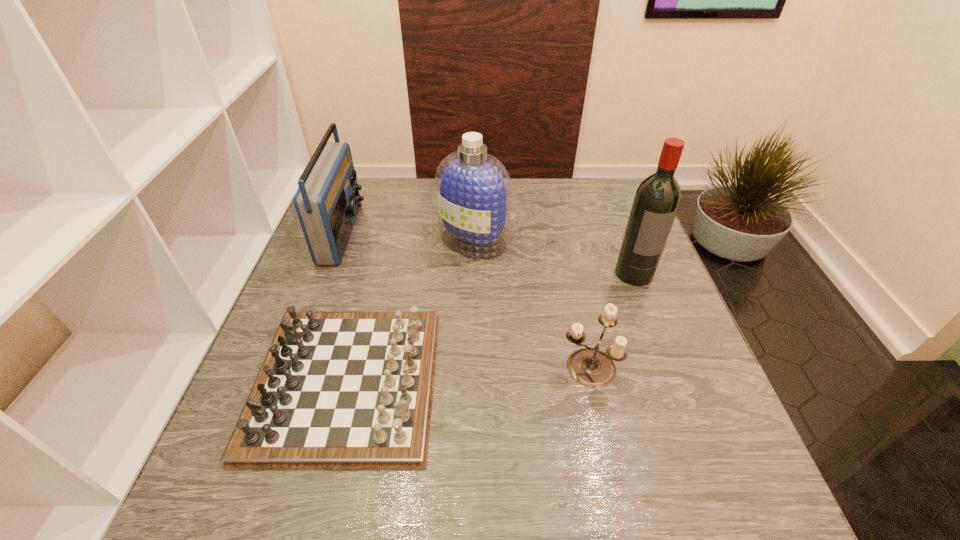
The height and width of the screenshot is (540, 960). Identify the location of the rightmost object. (657, 198).

I want to click on cleansing agent, so click(x=473, y=188).

Locate an element on the screen. the third tallest object is located at coordinates (327, 203).

What are the coordinates of `candle holder` in the screenshot? It's located at (589, 366).

The height and width of the screenshot is (540, 960). Find the location of `the second shortest object`. the second shortest object is located at coordinates (589, 366).

In order to click on chessboard in this screenshot , I will do `click(337, 390)`.

Find the location of a particular element. The height and width of the screenshot is (540, 960). vacant area located 0.310m on the label of the wine bottle is located at coordinates (682, 400).

Identify the location of free region located on the left of the second tallest object. The height and width of the screenshot is (540, 960). (380, 240).

Find the location of a particular element. This screenshot has width=960, height=540. vacant space located 0.280m on the front panel of the radio receiver is located at coordinates (459, 233).

Image resolution: width=960 pixels, height=540 pixels. I want to click on free spot located on the left of the second object from right to left, so click(436, 367).